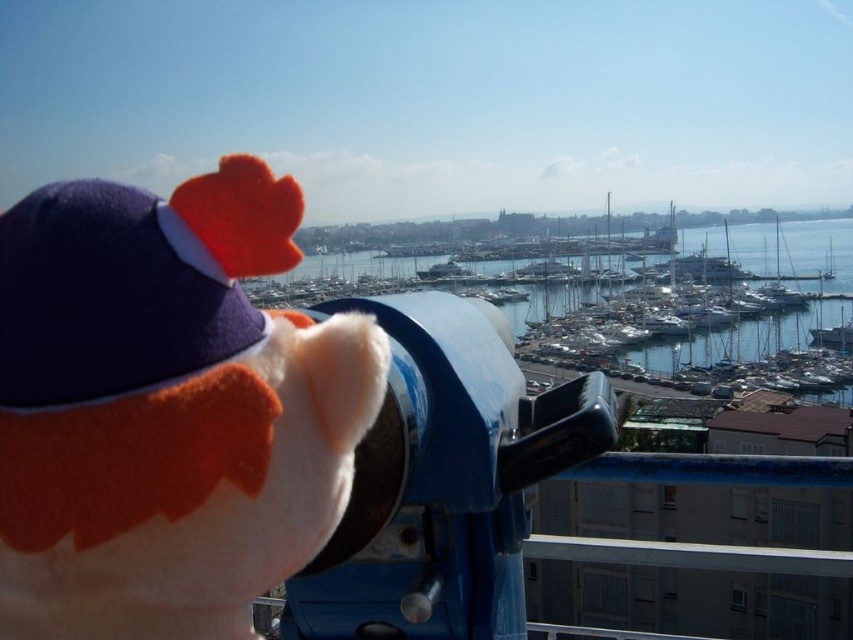
You are standing on a balcony overlooking a marina. You see a white plush toy at center and blue water at center. Which object is closer to the edge of the balcony?

The white plush toy at center is closer to the edge of the balcony because it is positioned below the blue water at center, indicating it is nearer to the viewer.

You are standing on the balcony and want to take a photo of the blue water at center without the white plush toy at center appearing in the shot. Is it possible to do so by moving the camera slightly to the left?

The white plush toy at center occupies less space than blue water at center, so yes, it is possible to move the camera slightly to the left to exclude the white plush toy at center from the frame while capturing the blue water at center.

You are standing on a balcony overlooking a marina and see the white plush toy at center and the blue water at center. Which object is nearer to you?

The white plush toy at center is closer to the viewer than the blue water at center.